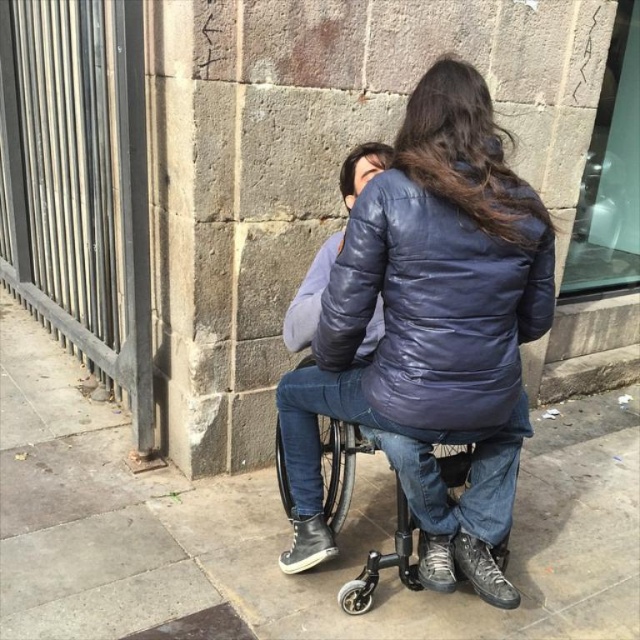
Question: Is concrete pavement at center bigger than matte blue jacket at center?

Choices:
 (A) yes
 (B) no

Answer: (A)

Question: Can you confirm if concrete pavement at center is wider than matte blue jacket at center?

Choices:
 (A) yes
 (B) no

Answer: (A)

Question: Which object is the closest to the black plastic wheelchair at center?

Choices:
 (A) concrete pavement at center
 (B) matte blue jacket at center

Answer: (B)

Question: Which of the following is the farthest from the observer?

Choices:
 (A) matte blue jacket at center
 (B) concrete pavement at center

Answer: (B)

Question: Does concrete pavement at center appear over black plastic wheelchair at center?

Choices:
 (A) yes
 (B) no

Answer: (B)

Question: Which of the following is the closest to the observer?

Choices:
 (A) (355, 433)
 (B) (541, 314)

Answer: (B)